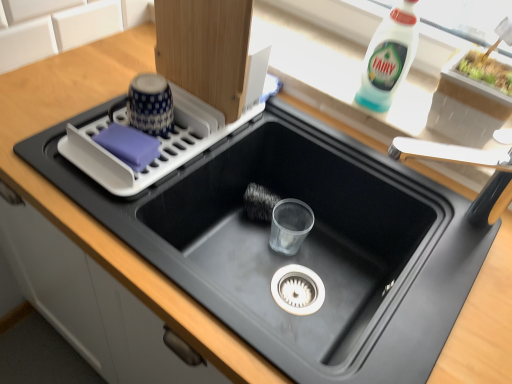
Locate an element on the screen. The height and width of the screenshot is (384, 512). vacant space situated on the left part of white plastic dish rack at upper left is located at coordinates (51, 90).